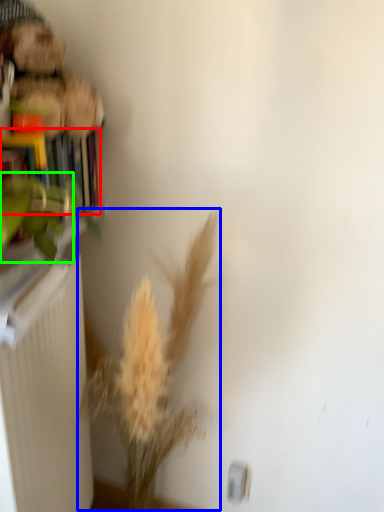
Question: Which object is the farthest from book (highlighted by a red box)? Choose among these: floral arrangement (highlighted by a blue box) or plant (highlighted by a green box).

Choices:
 (A) floral arrangement
 (B) plant

Answer: (A)